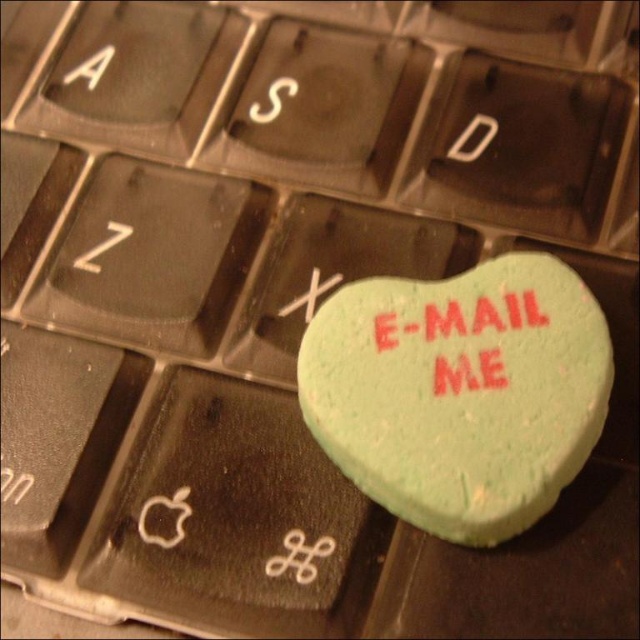
Question: Which point appears closest to the camera in this image?

Choices:
 (A) (500, 397)
 (B) (465, 362)

Answer: (A)

Question: Does green matte heart at center have a greater width compared to red rubber heart at center?

Choices:
 (A) no
 (B) yes

Answer: (B)

Question: Is green matte heart at center further to the viewer compared to red rubber heart at center?

Choices:
 (A) no
 (B) yes

Answer: (A)

Question: Can you confirm if green matte heart at center is smaller than red rubber heart at center?

Choices:
 (A) no
 (B) yes

Answer: (A)

Question: Which object appears closest to the camera in this image?

Choices:
 (A) red rubber heart at center
 (B) green matte heart at center

Answer: (B)